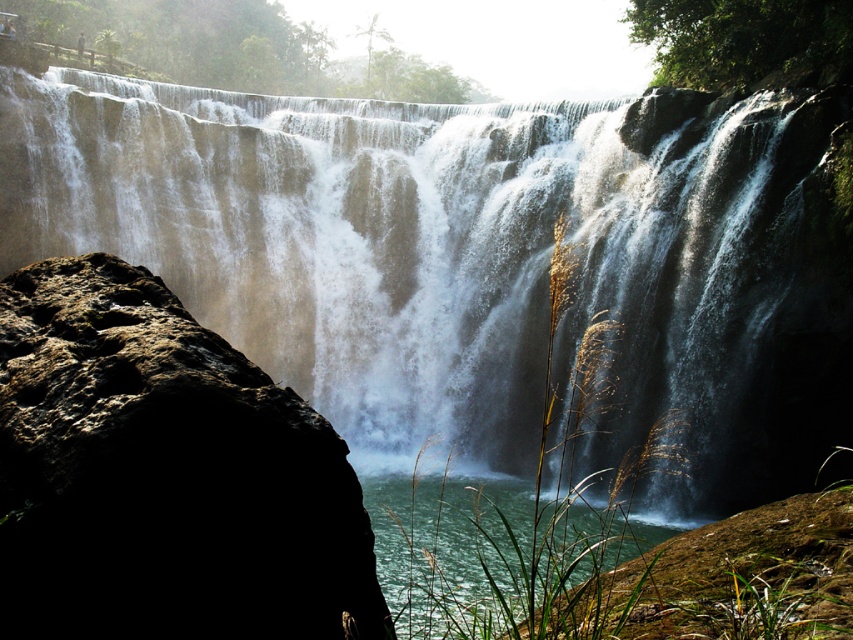
Does rough brown rock at left have a greater height compared to clear water at lower center?

No.

From the picture: Does rough brown rock at left come in front of clear water at lower center?

No, rough brown rock at left is behind clear water at lower center.

Who is more forward, (341, 611) or (474, 584)?

Point (341, 611) is more forward.

You are a GUI agent. You are given a task and a screenshot of the screen. Output one action in this format:
    pyautogui.click(x=<x>, y=<y>)
    Task: Click on the rough brown rock at left
    This screenshot has height=640, width=853.
    Given the screenshot: What is the action you would take?
    pyautogui.click(x=163, y=474)

Between point (660, 481) and point (439, 490), which one is positioned in front?

Point (660, 481) is in front.

Is white frothy water at center smaller than clear water at lower center?

Incorrect, white frothy water at center is not smaller in size than clear water at lower center.

Where is `white frothy water at center`? white frothy water at center is located at coordinates (459, 262).

I want to click on white frothy water at center, so click(x=459, y=262).

Is white frothy water at center smaller than rough brown rock at left?

Actually, white frothy water at center might be larger than rough brown rock at left.

Is white frothy water at center above rough brown rock at left?

Yes.

The height and width of the screenshot is (640, 853). Describe the element at coordinates (459, 262) in the screenshot. I see `white frothy water at center` at that location.

I want to click on white frothy water at center, so click(x=459, y=262).